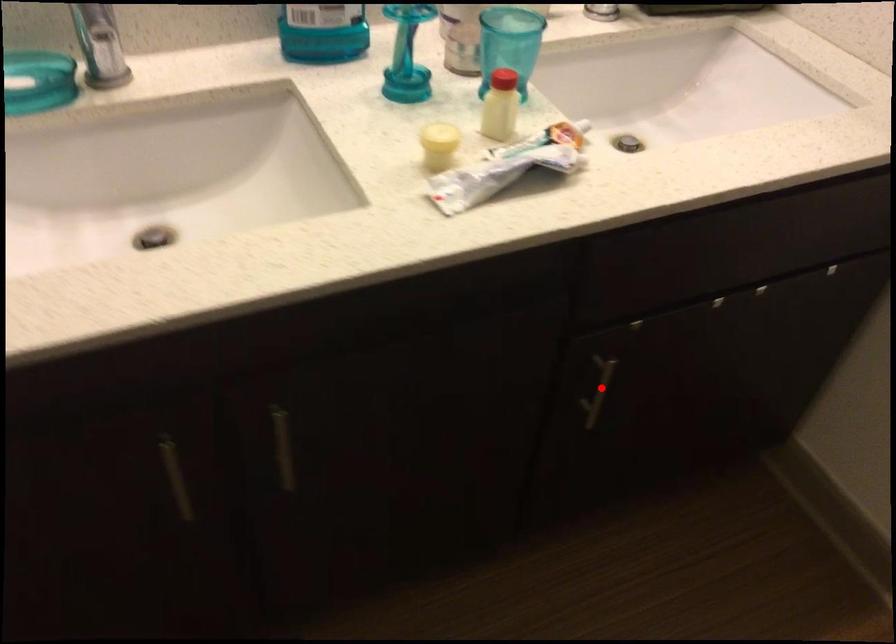
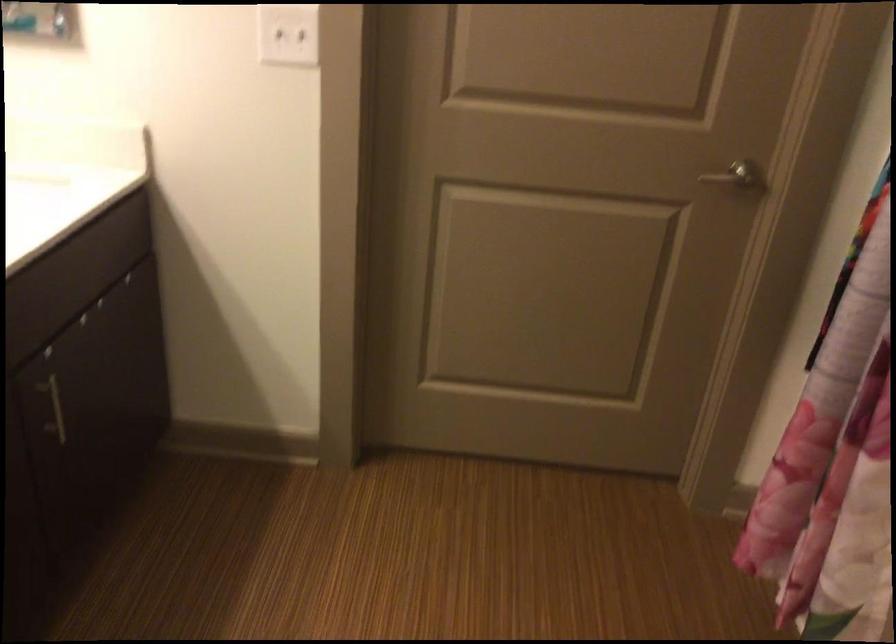
Question: I am providing you with two images of the same scene from different viewpoints. A red point is shown in image1. For the corresponding object point in image2, is it positioned nearer or farther from the camera?

Choices:
 (A) Nearer
 (B) Farther

Answer: (B)